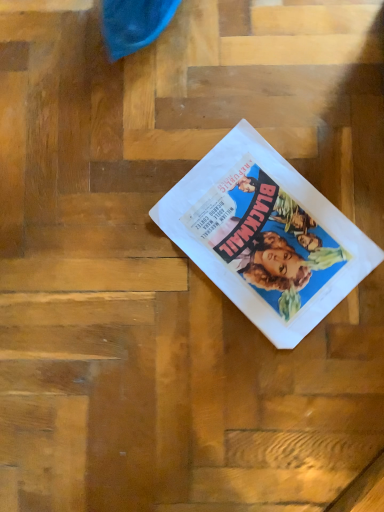
I want to click on white paper at center, so click(265, 236).

Image resolution: width=384 pixels, height=512 pixels. What do you see at coordinates (265, 236) in the screenshot?
I see `white paper at center` at bounding box center [265, 236].

Where is `white paper at center`? The width and height of the screenshot is (384, 512). white paper at center is located at coordinates (265, 236).